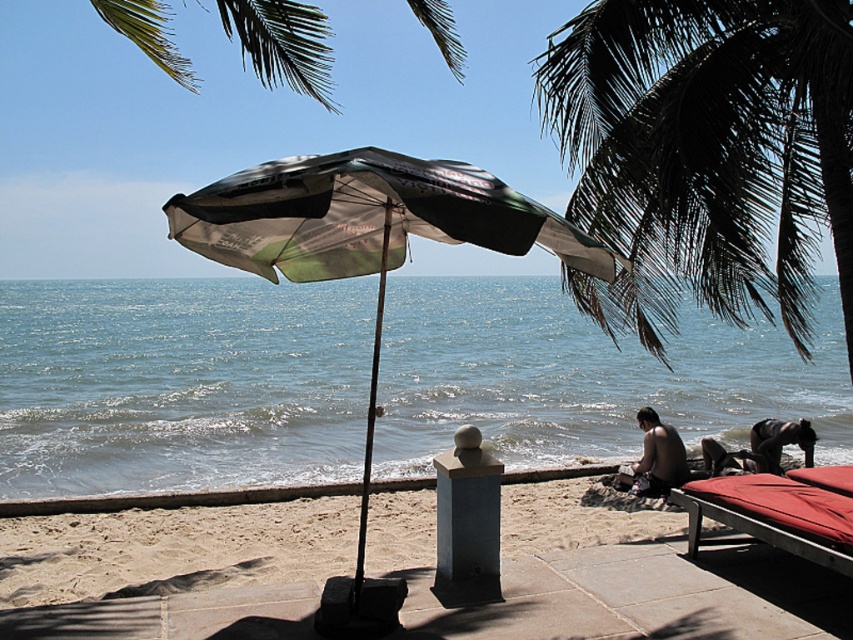
You are standing on the beach and want to know which object is higher between the blue water at center and the matte black umbrella at center. Can you determine this based on their positions?

The blue water at center is taller than the matte black umbrella at center, so the blue water at center is higher.

You are standing on the beach and want to take a photo of both the blue water at center and the dark green leafy palm tree at upper right. Which object will appear larger in the photo?

The blue water at center will appear larger in the photo because it is much taller than the dark green leafy palm tree at upper right.

You are at the beach and want to place your dark brown leather bag at lower right on the sand near the blue water at center. Can you put it directly next to the water without getting it wet?

The blue water at center is positioned over dark brown leather bag at lower right, so placing the bag directly next to the water may result in it getting wet due to the water being above the bag in the image. However, in reality, the bag is on the sand near the water, so it depends on the tide and waves. To keep it dry, place it further from the shoreline.